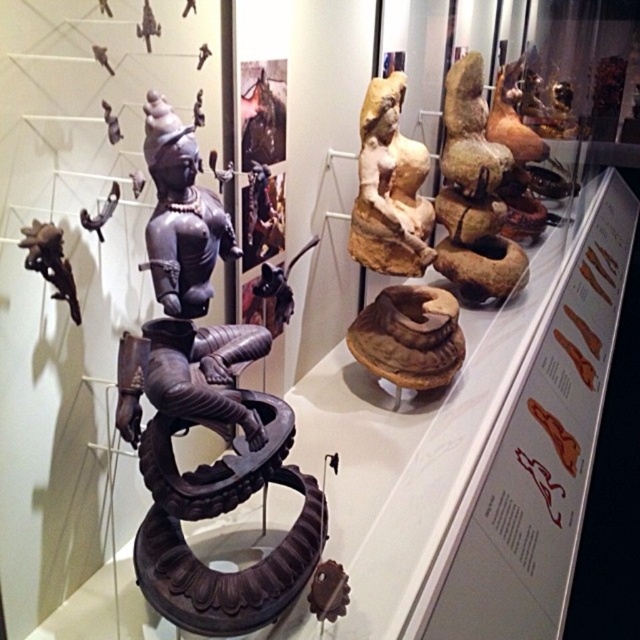
You are a museum visitor standing in front of the black polished wood statue at center. You want to take a photo of it without getting too close. If your camera can focus on objects up to 1.5 meters away, can you take a clear photo from your current position?

The black polished wood statue at center is 1.36 meters away from you, which is within the camera focus range of 1.5 meters. Therefore, you can take a clear photo from your current position.

You are a visitor at the museum and want to take a photo of the black polished wood statue at center and the matte beige statue at center. Which statue should you focus on first to ensure both are in the frame without moving the camera?

The black polished wood statue at center is in front of the matte beige statue at center, so focus on the matte beige statue at center first to ensure both are visible in the frame without moving the camera.

You are a museum visitor who wants to take a photo of both the black polished wood statue at center and the matte beige statue at center. Since you can only take one photo, which statue should you focus on to ensure it appears larger in the photo?

The black polished wood statue at center is much taller than the matte beige statue at center, so focusing on it will ensure it appears larger in the photo.